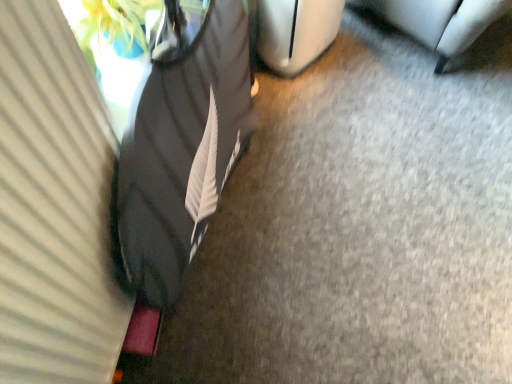
What is the approximate height of metallic silver trash can at lower right?

metallic silver trash can at lower right is 19.83 inches in height.

Locate an element on the screen. Image resolution: width=512 pixels, height=384 pixels. white matte curtain at left is located at coordinates (55, 207).

Measure the distance between point [219,35] and camera.

Point [219,35] and camera are 1.21 meters apart from each other.

The image size is (512, 384). What are the coordinates of `metallic silver trash can at lower right` in the screenshot? It's located at (439, 21).

Which point is more forward, (x=459, y=20) or (x=123, y=174)?

The point (x=123, y=174) is closer.

Do you think metallic silver trash can at lower right is within black fabric bean bag chair at left, or outside of it?

metallic silver trash can at lower right is spatially situated outside black fabric bean bag chair at left.

Considering the relative positions of metallic silver trash can at lower right and black fabric bean bag chair at left in the image provided, is metallic silver trash can at lower right to the left of black fabric bean bag chair at left from the viewer's perspective?

A: No, metallic silver trash can at lower right is not to the left of black fabric bean bag chair at left.

From the image's perspective, is metallic silver trash can at lower right beneath black fabric bean bag chair at left?

No, from the image's perspective, metallic silver trash can at lower right is not beneath black fabric bean bag chair at left.

Is white matte curtain at left taller than black fabric bean bag chair at left?

No, white matte curtain at left is not taller than black fabric bean bag chair at left.

From the image's perspective, who appears lower, white matte curtain at left or black fabric bean bag chair at left?

white matte curtain at left.

From a real-world perspective, is white matte curtain at left located beneath black fabric bean bag chair at left?

No, from a real-world perspective, white matte curtain at left is not beneath black fabric bean bag chair at left.

Is white matte curtain at left to the right of black fabric bean bag chair at left from the viewer's perspective?

Incorrect, white matte curtain at left is not on the right side of black fabric bean bag chair at left.

Considering the positions of objects metallic silver trash can at lower right and white matte curtain at left in the image provided, who is more to the right, metallic silver trash can at lower right or white matte curtain at left?

Positioned to the right is metallic silver trash can at lower right.

Does point (475, 8) lie in front of point (64, 89)?

No, (475, 8) is further to viewer.

Between metallic silver trash can at lower right and white matte curtain at left, which one has larger width?

metallic silver trash can at lower right is wider.

From the image's perspective, is metallic silver trash can at lower right positioned above or below white matte curtain at left?

Based on their image positions, metallic silver trash can at lower right is located above white matte curtain at left.

Does black fabric bean bag chair at left lie in front of metallic silver trash can at lower right?

Yes, the depth of black fabric bean bag chair at left is less than that of metallic silver trash can at lower right.

Identify the location of bean bag chair above the metallic silver trash can at lower right (from a real-world perspective). (183, 144).

Does black fabric bean bag chair at left contain metallic silver trash can at lower right?

No, metallic silver trash can at lower right is not surrounded by black fabric bean bag chair at left.

Looking at this image, is black fabric bean bag chair at left turned away from white matte curtain at left?

Yes, black fabric bean bag chair at left's orientation is away from white matte curtain at left.

Based on the photo, who is shorter, black fabric bean bag chair at left or white matte curtain at left?

Standing shorter between the two is white matte curtain at left.

Is black fabric bean bag chair at left smaller than white matte curtain at left?

Actually, black fabric bean bag chair at left might be larger than white matte curtain at left.

How much distance is there between black fabric bean bag chair at left and white matte curtain at left?

black fabric bean bag chair at left is 9.38 inches away from white matte curtain at left.

Considering the sizes of white matte curtain at left and metallic silver trash can at lower right in the image, is white matte curtain at left taller or shorter than metallic silver trash can at lower right?

Considering their sizes, white matte curtain at left has more height than metallic silver trash can at lower right.

Does white matte curtain at left have a smaller size compared to metallic silver trash can at lower right?

Correct, white matte curtain at left occupies less space than metallic silver trash can at lower right.

In the image, there is a white matte curtain at left. Where is `furniture below it (from a real-world perspective)`? furniture below it (from a real-world perspective) is located at coordinates (439, 21).

Is the position of white matte curtain at left more distant than that of metallic silver trash can at lower right?

No, white matte curtain at left is closer to the camera.

Image resolution: width=512 pixels, height=384 pixels. What are the coordinates of `bean bag chair positioned vertically above the metallic silver trash can at lower right (from a real-world perspective)` in the screenshot? It's located at (183, 144).

The image size is (512, 384). What are the coordinates of `curtain below the black fabric bean bag chair at left (from the image's perspective)` in the screenshot? It's located at (55, 207).

Estimate the real-world distances between objects in this image. Which object is further from metallic silver trash can at lower right, black fabric bean bag chair at left or white matte curtain at left?

The object further to metallic silver trash can at lower right is white matte curtain at left.

In the scene shown: Based on their spatial positions, is black fabric bean bag chair at left or metallic silver trash can at lower right closer to white matte curtain at left?

black fabric bean bag chair at left lies closer to white matte curtain at left than the other object.

Consider the image. Considering their positions, is white matte curtain at left positioned closer to metallic silver trash can at lower right than black fabric bean bag chair at left?

black fabric bean bag chair at left is positioned closer to the anchor metallic silver trash can at lower right.

Which object lies nearer to the anchor point black fabric bean bag chair at left, metallic silver trash can at lower right or white matte curtain at left?

white matte curtain at left is closer to black fabric bean bag chair at left.

Looking at the image, which one is located further to black fabric bean bag chair at left, white matte curtain at left or metallic silver trash can at lower right?

Among the two, metallic silver trash can at lower right is located further to black fabric bean bag chair at left.

In the scene shown: From the image, which object appears to be nearer to white matte curtain at left, metallic silver trash can at lower right or black fabric bean bag chair at left?

black fabric bean bag chair at left is closer to white matte curtain at left.

Find the location of `bean bag chair between white matte curtain at left and metallic silver trash can at lower right from left to right`. bean bag chair between white matte curtain at left and metallic silver trash can at lower right from left to right is located at coordinates (183, 144).